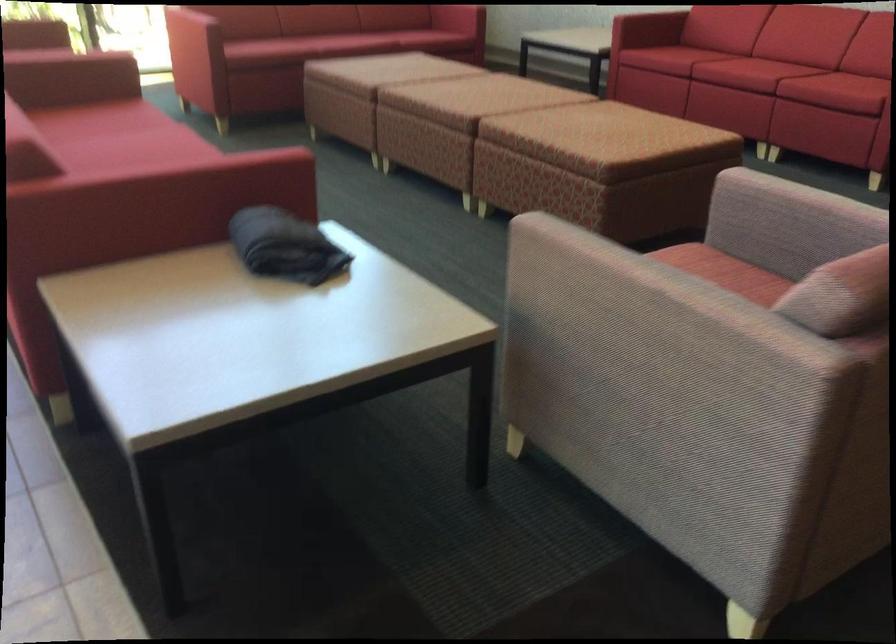
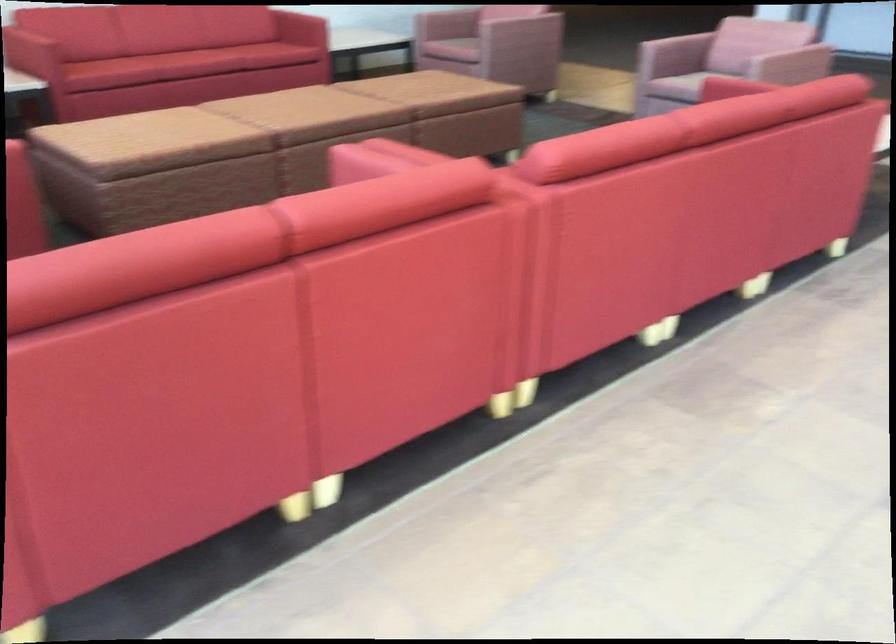
Question: In a continuous first-person perspective shot, in which direction is the camera moving?

Choices:
 (A) Left
 (B) Right
 (C) Forward
 (D) Backward

Answer: (D)